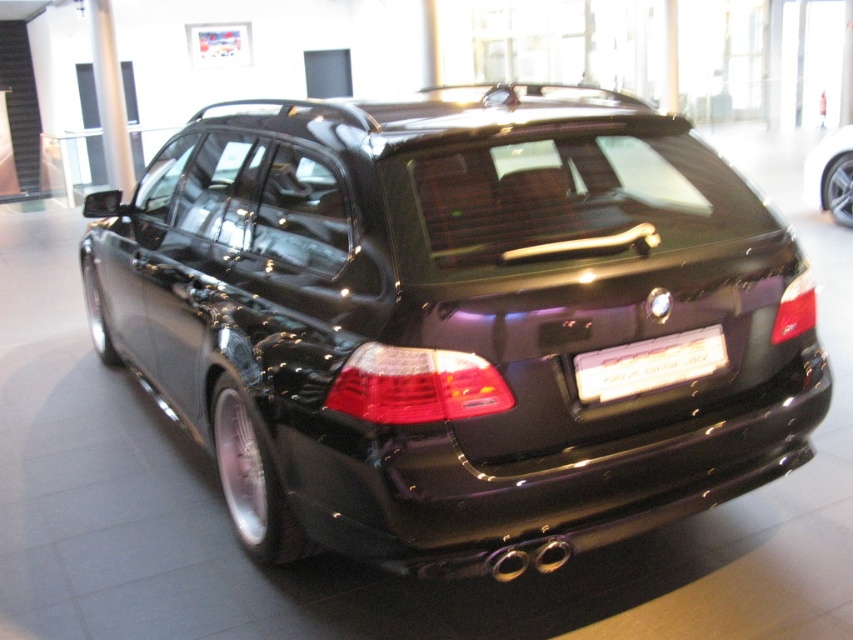
You are a parking assistant robot trying to align a car with its license plate. The car has a white plastic license plate at center. Where should you position the car so that the license plate is centered in the camera view? Please provide coordinates in the format of a point like this example format, e.g., point A is at point 0.5,0.5. The scene is the rear view of a black BMW station wagon in a showroom. The camera is positioned to capture the rear of the car. The license plate is located at the center of

The white plastic license plate at center is located at point (648,364), so you should position the car so that this point aligns with the center of the camera view.

You are a parking assistant trying to guide a driver to park their car. The driver needs to position their car so that the shiny black car at center is directly behind the white plastic license plate at center. Is this possible given the current arrangement?

The shiny black car at center is in front of the white plastic license plate at center, so it is already positioned directly behind the license plate. Therefore, the driver does not need to make any adjustments.

You are standing in front of the black BMW station wagon in the showroom. There are two points marked on the car, one at point coordinates [554,134] and the other at [808,172]. Which of these two points is closer to you?

Point [554,134] is closer to the viewer than point [808,172].